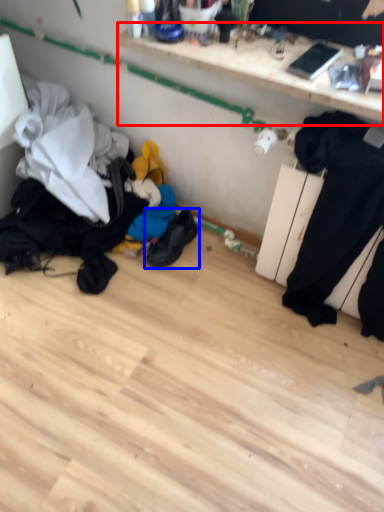
Question: Which point is closer to the camera, shelf (highlighted by a red box) or footwear (highlighted by a blue box)?

Choices:
 (A) shelf
 (B) footwear

Answer: (A)